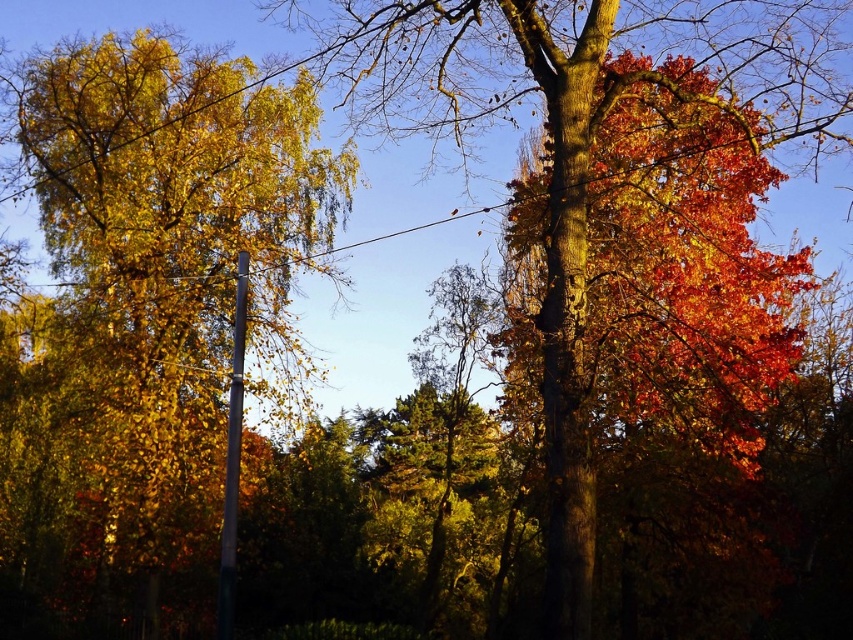
You are standing in the autumn scene and notice the golden yellow leaves at left and the metallic pole at left. Which object is bigger in size?

The golden yellow leaves at left has a larger size compared to the metallic pole at left.